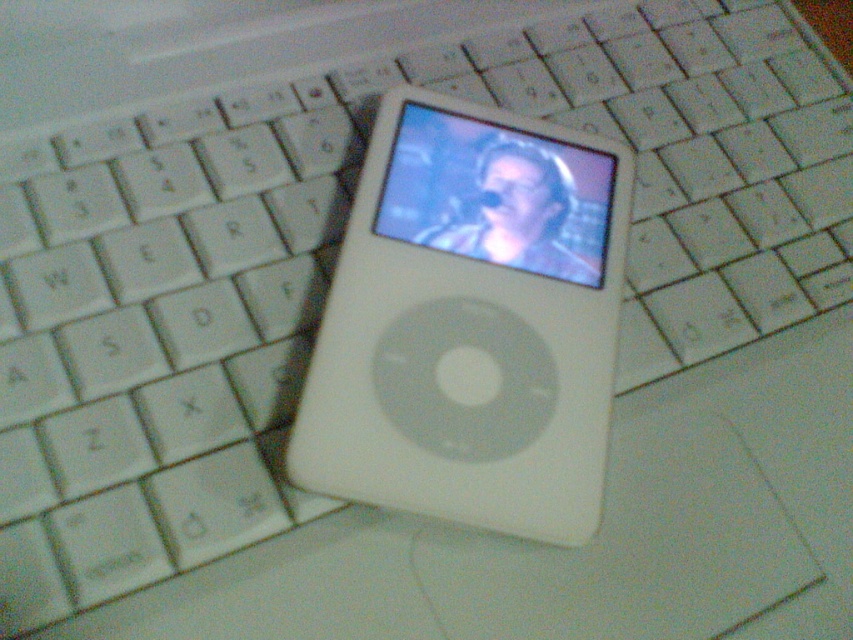
Is point (485, 163) positioned after point (486, 154)?

No.

Can you confirm if white plastic ipod at center is positioned above matte plastic screen at center?

No.

Measure the distance between point [550,259] and camera.

Point [550,259] and camera are 26.79 inches apart.

What are the coordinates of `white plastic ipod at center` in the screenshot? It's located at (469, 323).